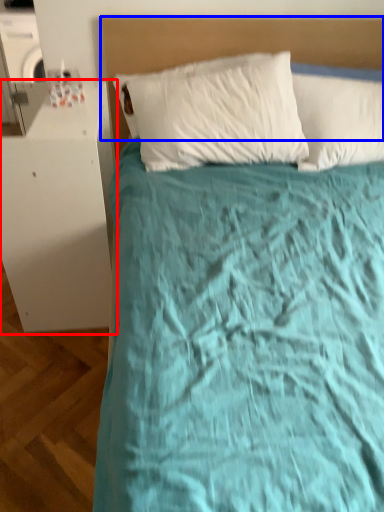
Question: Which object appears closest to the camera in this image, table (highlighted by a red box) or headboard (highlighted by a blue box)?

Choices:
 (A) table
 (B) headboard

Answer: (A)